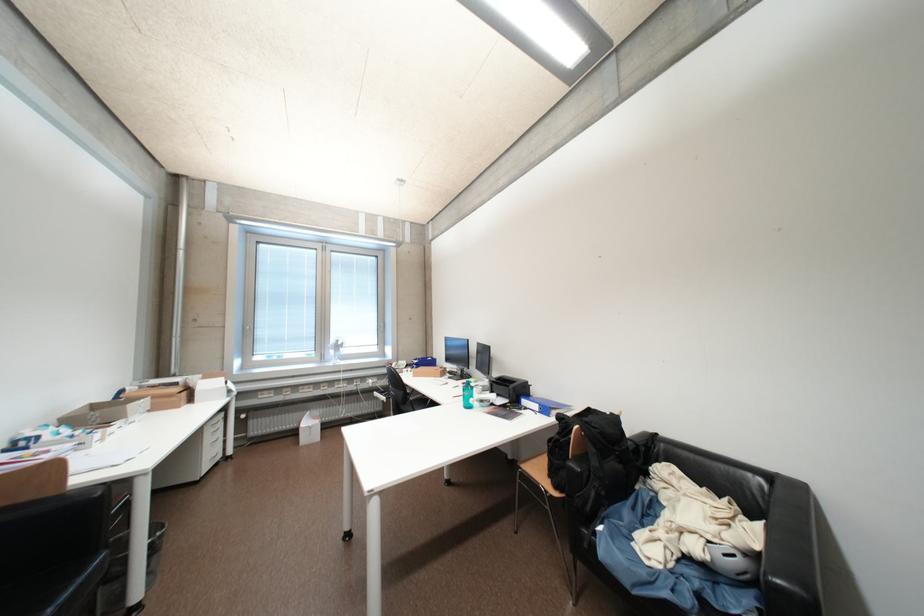
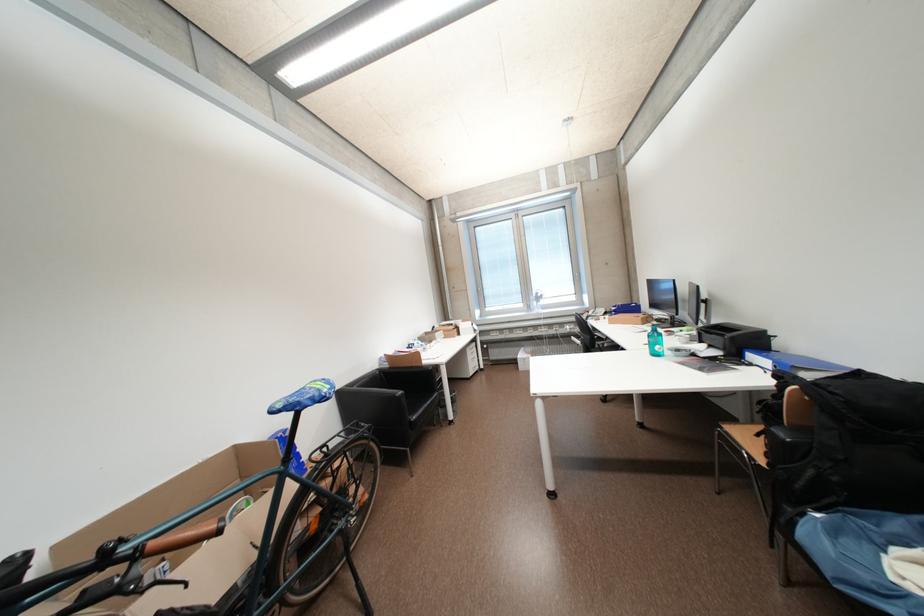
The point at (330, 359) is marked in the first image. Where is the corresponding point in the second image?

(537, 310)